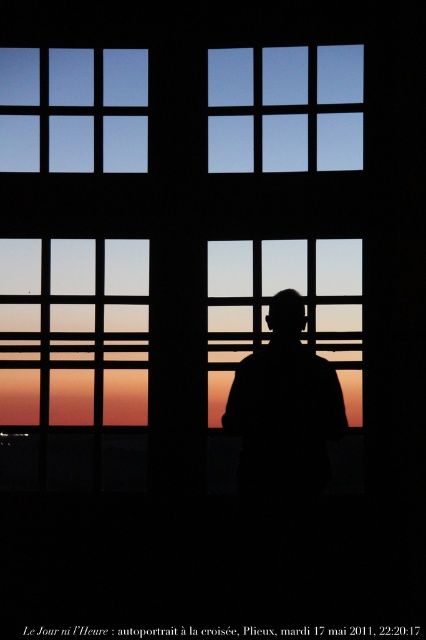
Question: Observing the image, what is the correct spatial positioning of transparent glass window at upper center in reference to black matte figure at center?

Choices:
 (A) above
 (B) below

Answer: (A)

Question: Which point is closer to the camera taking this photo?

Choices:
 (A) (339, 378)
 (B) (331, 74)
 (C) (129, 138)
 (D) (290, 449)

Answer: (D)

Question: Considering the real-world distances, which object is closest to the transparent glass window at center?

Choices:
 (A) transparent glass window at upper center
 (B) black matte figure at center
 (C) transparent glass window at upper left

Answer: (B)

Question: Can you confirm if transparent glass window at upper center is positioned below transparent glass window at upper left?

Choices:
 (A) yes
 (B) no

Answer: (B)

Question: Where is transparent glass window at upper center located in relation to transparent glass window at center in the image?

Choices:
 (A) left
 (B) right

Answer: (B)

Question: Which point appears farthest from the camera in this image?

Choices:
 (A) (331, 371)
 (B) (215, 307)
 (C) (100, 136)

Answer: (C)